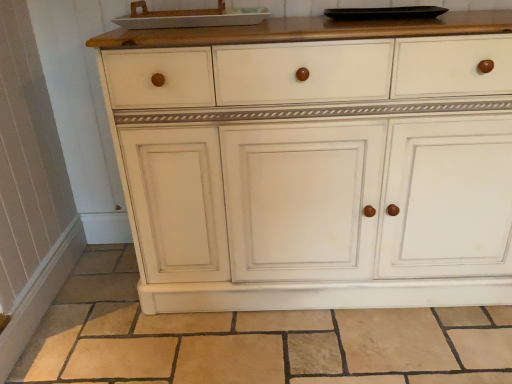
Question: Is white painted wood cabinet at center shorter than white glossy tray at upper center?

Choices:
 (A) no
 (B) yes

Answer: (A)

Question: Can you confirm if white painted wood cabinet at center is thinner than white glossy tray at upper center?

Choices:
 (A) no
 (B) yes

Answer: (A)

Question: Is there a large distance between white painted wood cabinet at center and white glossy tray at upper center?

Choices:
 (A) no
 (B) yes

Answer: (A)

Question: Can you confirm if white painted wood cabinet at center is bigger than white glossy tray at upper center?

Choices:
 (A) yes
 (B) no

Answer: (A)

Question: Is white painted wood cabinet at center smaller than white glossy tray at upper center?

Choices:
 (A) no
 (B) yes

Answer: (A)

Question: From their relative heights in the image, would you say white glossy tray at upper center is taller or shorter than beige tile at lower center?

Choices:
 (A) short
 (B) tall

Answer: (A)

Question: Based on their sizes in the image, would you say white glossy tray at upper center is bigger or smaller than beige tile at lower center?

Choices:
 (A) small
 (B) big

Answer: (A)

Question: In terms of width, does white glossy tray at upper center look wider or thinner when compared to beige tile at lower center?

Choices:
 (A) thin
 (B) wide

Answer: (A)

Question: Is point coord(220,3) closer or farther from the camera than point coord(434,322)?

Choices:
 (A) closer
 (B) farther

Answer: (B)

Question: Considering the positions of white painted wood cabinet at center and beige tile at lower center in the image, is white painted wood cabinet at center wider or thinner than beige tile at lower center?

Choices:
 (A) wide
 (B) thin

Answer: (B)

Question: Considering the relative positions of white painted wood cabinet at center and beige tile at lower center in the image provided, is white painted wood cabinet at center to the left or to the right of beige tile at lower center?

Choices:
 (A) left
 (B) right

Answer: (B)

Question: Is white painted wood cabinet at center taller or shorter than beige tile at lower center?

Choices:
 (A) short
 (B) tall

Answer: (B)

Question: Do you think white painted wood cabinet at center is within beige tile at lower center, or outside of it?

Choices:
 (A) outside
 (B) inside

Answer: (A)

Question: Looking at the image, does white painted wood cabinet at center seem bigger or smaller compared to white glossy tray at upper center?

Choices:
 (A) big
 (B) small

Answer: (A)

Question: Is white painted wood cabinet at center inside or outside of white glossy tray at upper center?

Choices:
 (A) outside
 (B) inside

Answer: (A)